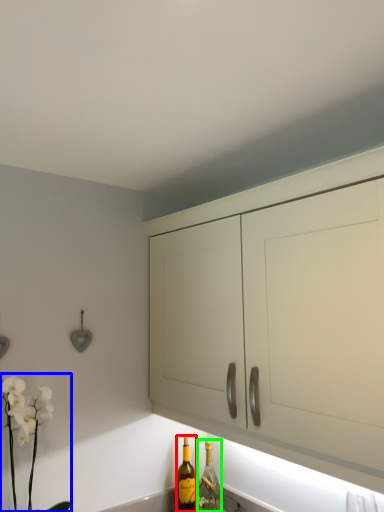
Question: Which object is the farthest from bottle (highlighted by a red box)? Choose among these: floral arrangement (highlighted by a blue box) or bottle (highlighted by a green box).

Choices:
 (A) floral arrangement
 (B) bottle

Answer: (A)